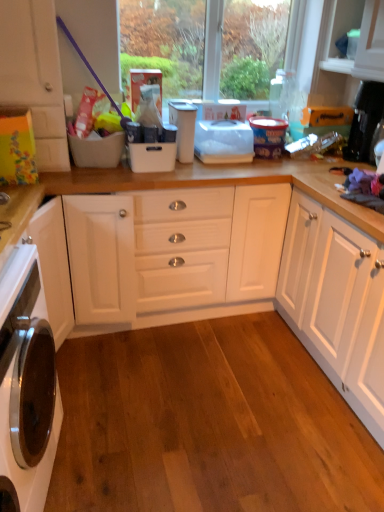
Find the location of a particular element. vacant point to the right of white glossy oven at lower left is located at coordinates (127, 455).